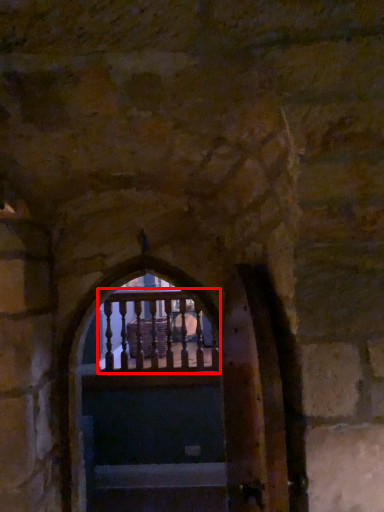
Question: In this image, where is balcony (annotated by the red box) located relative to stairs?

Choices:
 (A) left
 (B) right

Answer: (A)